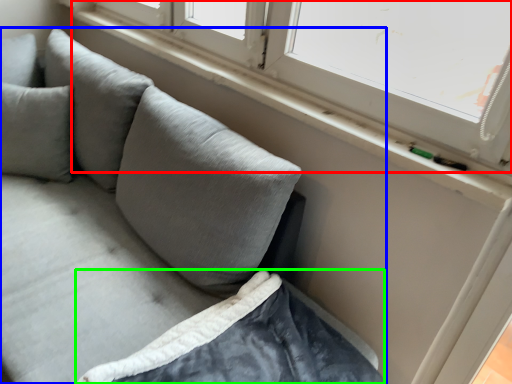
Question: Based on their relative distances, which object is farther from window (highlighted by a red box)? Choose from studio couch (highlighted by a blue box) and sheet (highlighted by a green box).

Choices:
 (A) studio couch
 (B) sheet

Answer: (B)